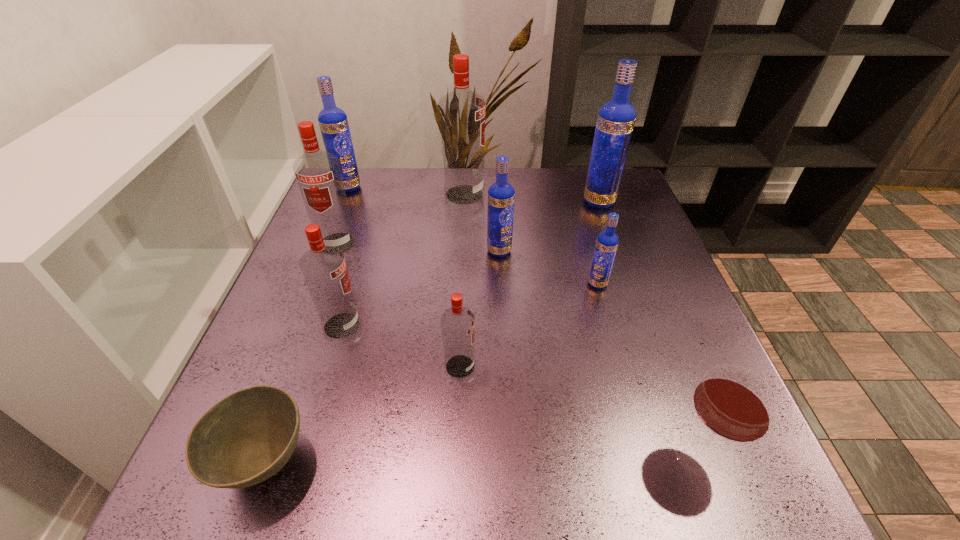
This screenshot has width=960, height=540. Find the location of `free space located 0.270m on the front label of the third biggest red vodka`. free space located 0.270m on the front label of the third biggest red vodka is located at coordinates (497, 325).

Image resolution: width=960 pixels, height=540 pixels. What are the coordinates of `free space located on the front of the smallest blue vodka` in the screenshot? It's located at (647, 461).

Identify the location of free region located on the front label of the eighth farthest object. The image size is (960, 540). (624, 366).

This screenshot has width=960, height=540. I want to click on free space located on the left of the wineglass, so click(x=589, y=455).

You are a GUI agent. You are given a task and a screenshot of the screen. Output one action in this format:
    pyautogui.click(x=<x>, y=<y>)
    Task: Click on the free region located 0.380m on the right of the shortest object
    The image size is (960, 540).
    Given the screenshot: What is the action you would take?
    pyautogui.click(x=563, y=462)

Image resolution: width=960 pixels, height=540 pixels. Identify the location of wineglass situated at the near edge. (734, 403).

Find the location of a particular element. This screenshot has height=540, width=960. bowl that is at the near edge is located at coordinates (247, 437).

This screenshot has height=540, width=960. What are the coordinates of `bowl located at the left edge` in the screenshot? It's located at (247, 437).

Locate an element on the screen. The height and width of the screenshot is (540, 960). wineglass that is at the right edge is located at coordinates [734, 403].

Identify the location of object that is at the far left corner. (333, 122).